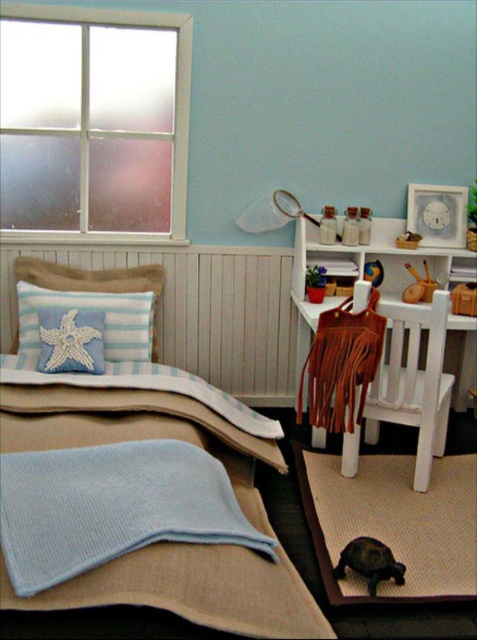
You are standing in the bedroom corner and want to place a new decorative pillow exactly where the blue textured blanket at lower left is located. According to the coordinates provided, where should you place the new pillow?

The blue textured blanket at lower left is located at coordinates point (193, 589), so the new decorative pillow should be placed at that exact position.

You are organizing the blankets on the bed and need to know which blanket is closer to you. Which one is in front between the blue textured blanket at lower left and the light blue knitted blanket at lower left?

The blue textured blanket at lower left is in front of the light blue knitted blanket at lower left, so it is closer to you.